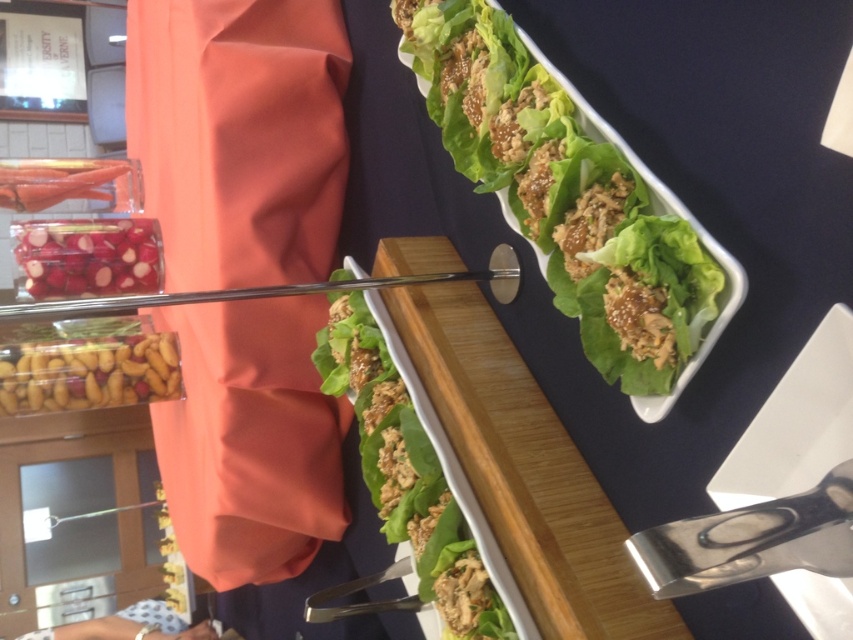
Based on the photo, is translucent plastic container at lower left further to the viewer compared to smooth red radish at left?

No, translucent plastic container at lower left is closer to the viewer.

Who is more distant from viewer, (57,392) or (111,220)?

Point (111,220)

This screenshot has height=640, width=853. In order to click on translucent plastic container at lower left in this screenshot , I will do `click(88, 372)`.

Can you confirm if green leafy lettuce at upper right is bigger than translucent plastic container at lower left?

Yes.

Is green leafy lettuce at upper right below translucent plastic container at lower left?

Incorrect, green leafy lettuce at upper right is not positioned below translucent plastic container at lower left.

Locate an element on the screen. green leafy lettuce at upper right is located at coordinates (564, 195).

Locate an element on the screen. Image resolution: width=853 pixels, height=640 pixels. green leafy lettuce at upper right is located at coordinates (564, 195).

Between point (434, 524) and point (57, 195), which one is positioned in front?

Point (434, 524) is in front.

Can you confirm if green leafy lettuce at center is wider than glossy plastic bag at upper left?

Correct, the width of green leafy lettuce at center exceeds that of glossy plastic bag at upper left.

The width and height of the screenshot is (853, 640). Describe the element at coordinates (407, 472) in the screenshot. I see `green leafy lettuce at center` at that location.

Where is `green leafy lettuce at center`? green leafy lettuce at center is located at coordinates (407, 472).